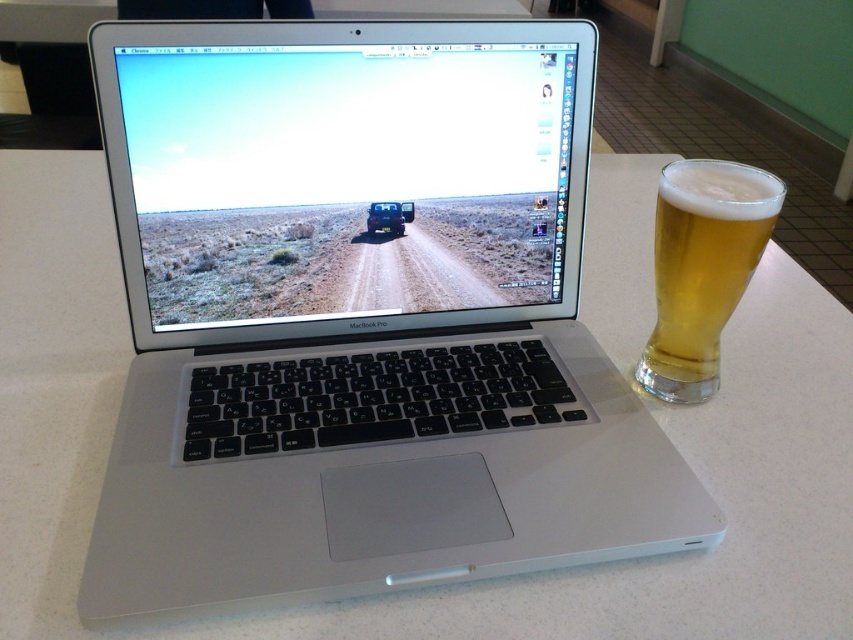
Which is behind, point (531, 476) or point (729, 298)?

Point (729, 298)

Does silver metallic laptop at center have a lesser height compared to golden glass beer at right?

No.

Who is more distant from viewer, (531, 140) or (680, 209)?

Point (531, 140)

This screenshot has height=640, width=853. Find the location of `silver metallic laptop at center`. silver metallic laptop at center is located at coordinates (358, 317).

Is point (680, 182) positioned in front of point (396, 208)?

Yes.

Who is higher up, golden glass beer at right or metallic blue jeep at center?

Positioned higher is metallic blue jeep at center.

Where is `golden glass beer at right`? golden glass beer at right is located at coordinates (701, 268).

Describe the element at coordinates (358, 317) in the screenshot. The width and height of the screenshot is (853, 640). I see `silver metallic laptop at center` at that location.

Can you confirm if silver metallic laptop at center is thinner than metallic blue jeep at center?

No, silver metallic laptop at center is not thinner than metallic blue jeep at center.

Between point (136, 292) and point (405, 208), which one is positioned behind?

The point (405, 208) is more distant.

What are the coordinates of `silver metallic laptop at center` in the screenshot? It's located at (358, 317).